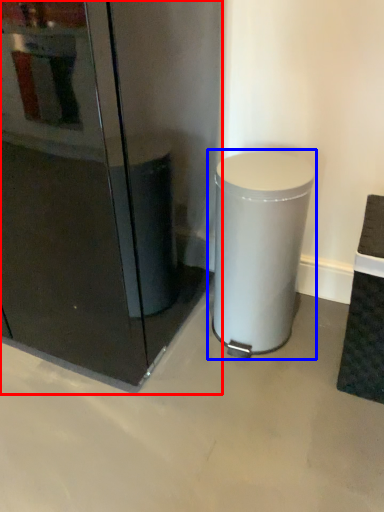
Question: Which object appears farthest to the camera in this image, fridge (highlighted by a red box) or waste container (highlighted by a blue box)?

Choices:
 (A) fridge
 (B) waste container

Answer: (B)